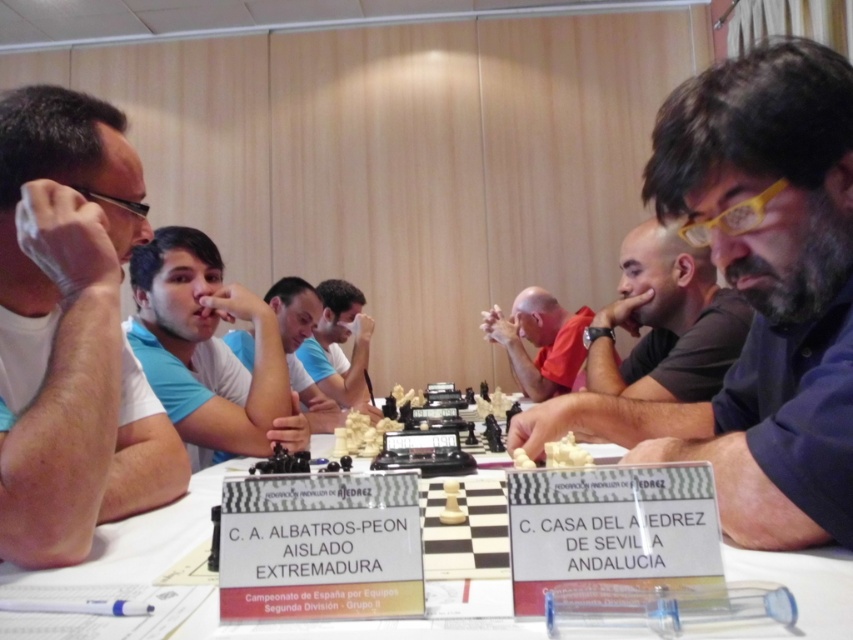
Is the position of matte black chess piece at center more distant than that of white matte shirt at left?

No.

Can you confirm if matte black chess piece at center is positioned to the left of white matte shirt at left?

Incorrect, matte black chess piece at center is not on the left side of white matte shirt at left.

Where is `matte black chess piece at center`? This screenshot has height=640, width=853. matte black chess piece at center is located at coordinates (756, 292).

Which is below, light blue fabric shirt at center or white plastic chessboard at center?

white plastic chessboard at center is below.

Based on the photo, is light blue fabric shirt at center below white plastic chessboard at center?

Actually, light blue fabric shirt at center is above white plastic chessboard at center.

Measure the distance between light blue fabric shirt at center and camera.

The distance of light blue fabric shirt at center from camera is 4.33 feet.

Identify the location of light blue fabric shirt at center. (207, 352).

Does light blue fabric shirt at center appear on the left side of dark gray shirt at center?

Correct, you'll find light blue fabric shirt at center to the left of dark gray shirt at center.

Does light blue fabric shirt at center have a smaller size compared to dark gray shirt at center?

Actually, light blue fabric shirt at center might be larger than dark gray shirt at center.

This screenshot has width=853, height=640. Describe the element at coordinates (207, 352) in the screenshot. I see `light blue fabric shirt at center` at that location.

Locate an element on the screen. light blue fabric shirt at center is located at coordinates (207, 352).